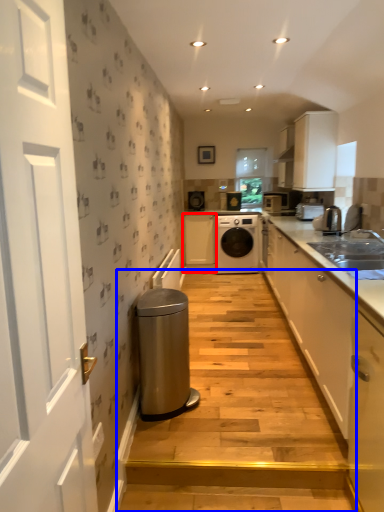
Question: Which of the following is the farthest to the observer, cabinetry (highlighted by a red box) or stairwell (highlighted by a blue box)?

Choices:
 (A) cabinetry
 (B) stairwell

Answer: (A)